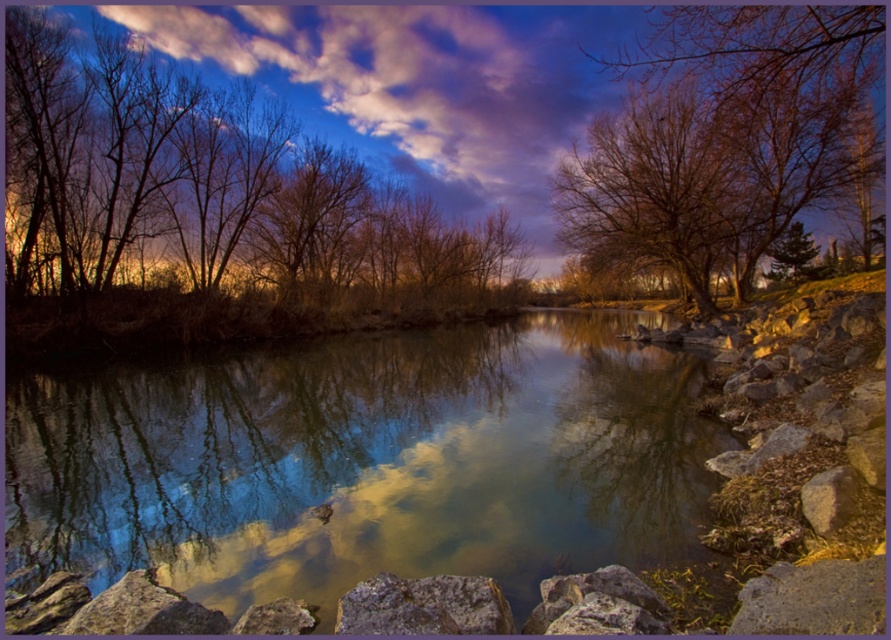
Question: Which point is closer to the camera taking this photo?

Choices:
 (A) (811, 477)
 (B) (83, 157)

Answer: (A)

Question: Can you confirm if bare branches at upper right is positioned to the left of gray matte rock at lower right?

Choices:
 (A) yes
 (B) no

Answer: (B)

Question: Can you confirm if brown/dry wood trees at upper left is smaller than gray matte rock at lower right?

Choices:
 (A) yes
 (B) no

Answer: (B)

Question: Among these points, which one is nearest to the camera?

Choices:
 (A) (111, 561)
 (B) (832, 490)
 (C) (129, 244)
 (D) (730, 172)

Answer: (B)

Question: Does brown/dry wood trees at upper left have a greater width compared to bare branches at upper right?

Choices:
 (A) no
 (B) yes

Answer: (B)

Question: Which point is closer to the camera?

Choices:
 (A) brown/dry wood trees at upper left
 (B) clear water at center
 (C) gray matte rock at lower right

Answer: (B)